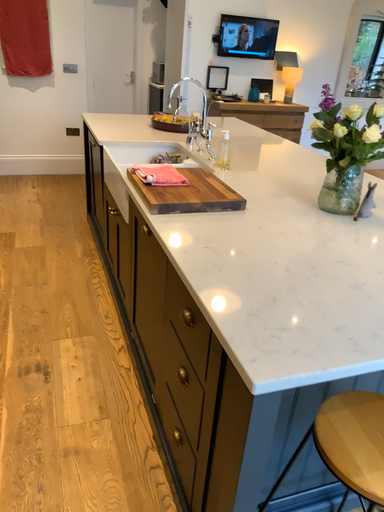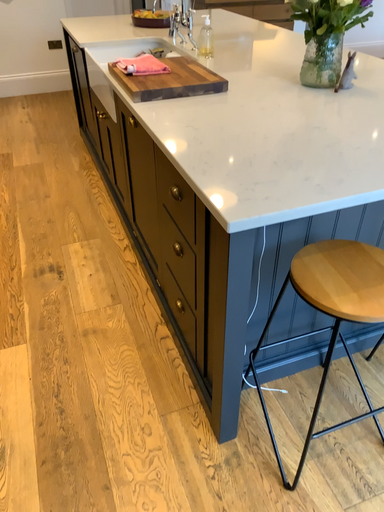
Question: How did the camera likely rotate when shooting the video?

Choices:
 (A) rotated upward
 (B) rotated downward

Answer: (B)